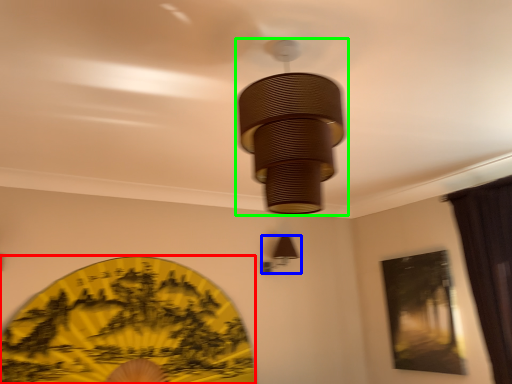
Question: Based on their relative distances, which object is nearer to design (highlighted by a red box)? Choose from lamp (highlighted by a blue box) and lamp (highlighted by a green box).

Choices:
 (A) lamp
 (B) lamp

Answer: (A)